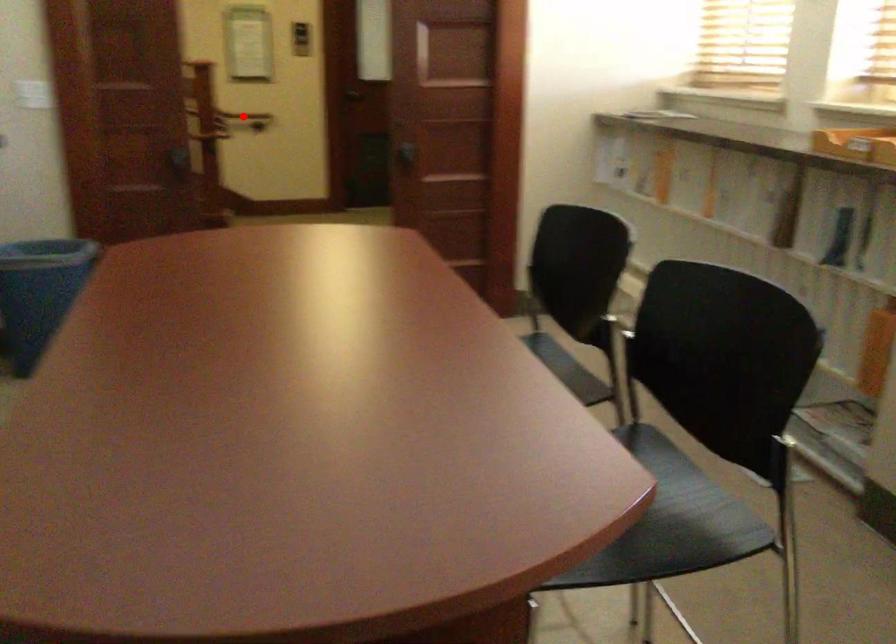
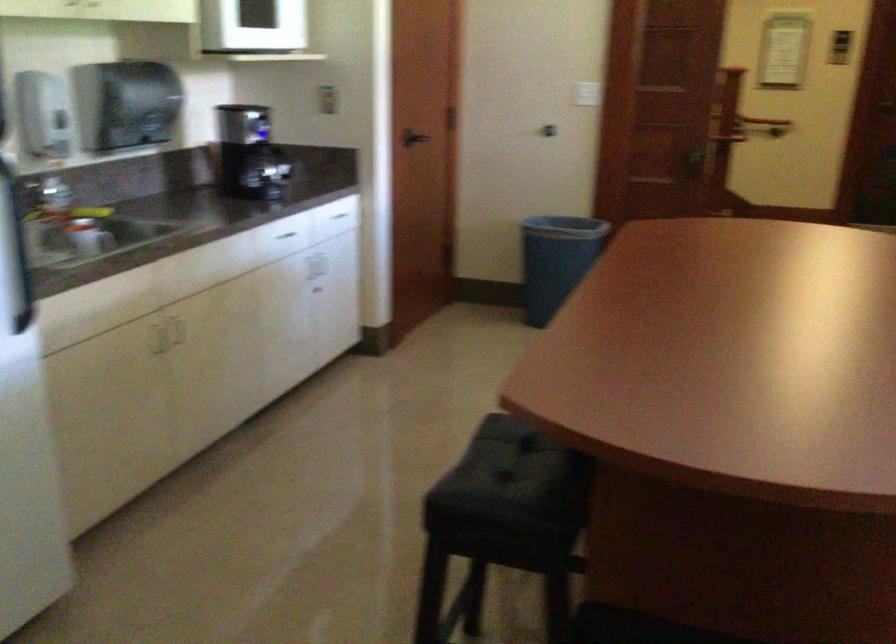
Question: I am providing you with two images of the same scene from different viewpoints. A red point is marked on the first image. Can you still see the location of the red point in image 2?

Choices:
 (A) Yes
 (B) No

Answer: (B)